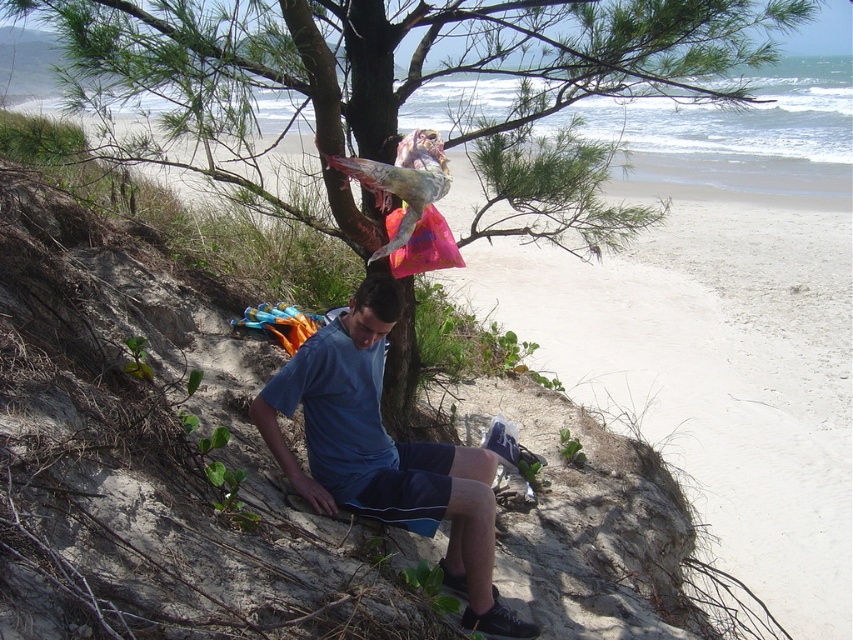
Question: Which point is farther from the camera taking this photo?

Choices:
 (A) (585, 182)
 (B) (335, 380)

Answer: (A)

Question: Can you confirm if green leafy tree at center is positioned to the left of blue fabric shorts at center?

Choices:
 (A) no
 (B) yes

Answer: (A)

Question: Which of the following is the closest to the observer?

Choices:
 (A) blue fabric shorts at center
 (B) green leafy tree at center

Answer: (B)

Question: Can you confirm if green leafy tree at center is smaller than blue fabric shorts at center?

Choices:
 (A) yes
 (B) no

Answer: (B)

Question: Is green leafy tree at center positioned in front of blue fabric shorts at center?

Choices:
 (A) no
 (B) yes

Answer: (B)